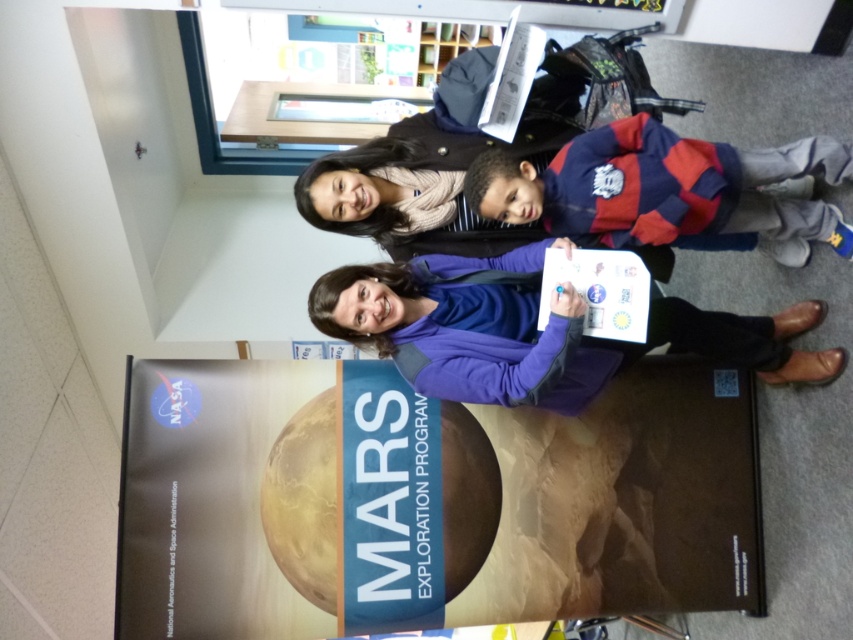
Question: Does purple fabric jacket at center have a greater width compared to transparent glass table at upper center?

Choices:
 (A) no
 (B) yes

Answer: (B)

Question: Where is striped fleece jacket at center located in relation to transparent glass table at upper center in the image?

Choices:
 (A) below
 (B) above

Answer: (A)

Question: Which object appears closest to the camera in this image?

Choices:
 (A) striped fleece jacket at center
 (B) purple fabric jacket at center

Answer: (B)

Question: Estimate the real-world distances between objects in this image. Which object is closer to the purple fabric jacket at center?

Choices:
 (A) transparent glass table at upper center
 (B) striped fleece jacket at center

Answer: (B)

Question: Can you confirm if striped fleece jacket at center is smaller than transparent glass table at upper center?

Choices:
 (A) yes
 (B) no

Answer: (A)

Question: Which object is farther from the camera taking this photo?

Choices:
 (A) transparent glass table at upper center
 (B) purple fabric jacket at center

Answer: (A)